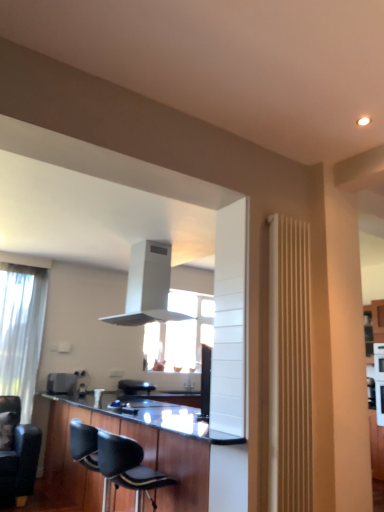
This screenshot has width=384, height=512. I want to click on white textured radiator at right, so click(289, 366).

What do you see at coordinates (115, 462) in the screenshot?
I see `black leather chair at lower center, arranged as the second chair when viewed from the left` at bounding box center [115, 462].

Identify the location of white sheer curtain at left. Image resolution: width=384 pixels, height=512 pixels. (21, 331).

Measure the distance between point (143, 254) and camera.

Point (143, 254) is 4.10 meters away from camera.

Locate an element on the screen. The width and height of the screenshot is (384, 512). white textured radiator at right is located at coordinates (289, 366).

Considering the points (177, 450) and (310, 458), which point is behind, point (177, 450) or point (310, 458)?

Positioned behind is point (177, 450).

From a real-world perspective, between black wood cabinetry at lower center and white textured radiator at right, who is vertically higher?

In real-world perspective, white textured radiator at right is above.

In the scene shown: Is black wood cabinetry at lower center taller than white textured radiator at right?

No, black wood cabinetry at lower center is not taller than white textured radiator at right.

Can we say black wood cabinetry at lower center lies outside white textured radiator at right?

black wood cabinetry at lower center is positioned outside white textured radiator at right.

Is black leather chair at lower center, which is counted as the second chair, starting from the back, beside black leather armchair at center?

No.

Measure the distance from black leather chair at lower center, which is counted as the first chair, starting from the right, to black leather armchair at center.

A distance of 1.19 meters exists between black leather chair at lower center, which is counted as the first chair, starting from the right, and black leather armchair at center.

From a real-world perspective, is black leather chair at lower center, which is counted as the first chair, starting from the right, positioned under black leather armchair at center based on gravity?

Yes, from a real-world perspective, black leather chair at lower center, which is counted as the first chair, starting from the right, is beneath black leather armchair at center.

Locate an element on the screen. The image size is (384, 512). the 1st chair directly beneath the black leather armchair at center (from a real-world perspective) is located at coordinates (115, 462).

How many degrees apart are the facing directions of black leather chair at lower left, which is counted as the 2th chair, starting from the front, and white matte exhaust hood at upper center?

black leather chair at lower left, which is counted as the 2th chair, starting from the front, and white matte exhaust hood at upper center are facing 91.3 degrees away from each other.

From the image's perspective, which object appears higher, black leather chair at lower left, the second chair in the right-to-left sequence, or white matte exhaust hood at upper center?

white matte exhaust hood at upper center appears higher in the image.

I want to click on exhaust hood above the black leather chair at lower left, the first chair positioned from the back (from the image's perspective), so 147,286.

Are black leather chair at lower left, which is counted as the 2th chair, starting from the front, and white matte exhaust hood at upper center far apart?

Yes.

Is black leather armchair at center positioned with its back to white sheer curtain at left?

No, white sheer curtain at left is not at the back of black leather armchair at center.

Looking at this image, is black leather armchair at center in contact with white sheer curtain at left?

There is a gap between black leather armchair at center and white sheer curtain at left.

From the image's perspective, would you say black leather armchair at center is shown under white sheer curtain at left?

Yes, from the image's perspective, black leather armchair at center is beneath white sheer curtain at left.

Is black leather armchair at center located outside white sheer curtain at left?

Yes.

How different are the orientations of white matte exhaust hood at upper center and satin black toaster at lower left in degrees?

The angular difference between white matte exhaust hood at upper center and satin black toaster at lower left is 2.75 degrees.

Looking at this image, is white matte exhaust hood at upper center far away from satin black toaster at lower left?

Yes, white matte exhaust hood at upper center and satin black toaster at lower left are located far from each other.

Looking at this image, which of these two, white matte exhaust hood at upper center or satin black toaster at lower left, is bigger?

With larger size is white matte exhaust hood at upper center.

From a real-world perspective, relative to satin black toaster at lower left, is white matte exhaust hood at upper center vertically above or below?

From a real-world perspective, white matte exhaust hood at upper center is physically above satin black toaster at lower left.

Is white matte exhaust hood at upper center turned away from black leather armchair at center?

No, white matte exhaust hood at upper center's orientation is not away from black leather armchair at center.

Is white matte exhaust hood at upper center outside of black leather armchair at center?

Indeed, white matte exhaust hood at upper center is completely outside black leather armchair at center.

How different are the orientations of white matte exhaust hood at upper center and black leather armchair at center in degrees?

92.6 degrees separate the facing orientations of white matte exhaust hood at upper center and black leather armchair at center.

Relative to black leather armchair at center, is white matte exhaust hood at upper center in front or behind?

Clearly, white matte exhaust hood at upper center is in front of black leather armchair at center.

Who is shorter, black wood cabinetry at lower center or white matte exhaust hood at upper center?

white matte exhaust hood at upper center is shorter.

From the image's perspective, who appears lower, black wood cabinetry at lower center or white matte exhaust hood at upper center?

black wood cabinetry at lower center is shown below in the image.

Find the location of `cabinetry to the right of white matte exhaust hood at upper center`. cabinetry to the right of white matte exhaust hood at upper center is located at coordinates (153, 454).

Considering the relative positions of black wood cabinetry at lower center and white matte exhaust hood at upper center in the image provided, is black wood cabinetry at lower center to the left of white matte exhaust hood at upper center from the viewer's perspective?

No.

You are a GUI agent. You are given a task and a screenshot of the screen. Output one action in this format:
    pyautogui.click(x=<x>, y=<y>)
    Task: Click on the cabinetry to the left of white textured radiator at right
    The image size is (384, 512).
    Given the screenshot: What is the action you would take?
    pyautogui.click(x=153, y=454)

In the image, there is a black leather armchair at center. Find the location of `chair above it (from the image's perspective)`. chair above it (from the image's perspective) is located at coordinates (115, 462).

Looking at the image, which one is located further to black leather chair at lower center, which is counted as the first chair, starting from the right, satin black toaster at lower left or black leather chair at lower left, the second chair in the right-to-left sequence?

The object further to black leather chair at lower center, which is counted as the first chair, starting from the right, is satin black toaster at lower left.

Based on their spatial positions, is black leather chair at lower left, which is counted as the 2th chair, starting from the front, or black wood cabinetry at lower center closer to white matte exhaust hood at upper center?

Based on the image, black wood cabinetry at lower center appears to be nearer to white matte exhaust hood at upper center.

Which object lies further to the anchor point white textured radiator at right, white sheer curtain at left or white matte exhaust hood at upper center?

The object further to white textured radiator at right is white sheer curtain at left.

Which object lies nearer to the anchor point white textured radiator at right, satin black toaster at lower left or white sheer curtain at left?

satin black toaster at lower left lies closer to white textured radiator at right than the other object.

Looking at the image, which one is located further to white sheer curtain at left, white textured radiator at right or satin black toaster at lower left?

white textured radiator at right.

Consider the image. Estimate the real-world distances between objects in this image. Which object is closer to satin black toaster at lower left, white textured radiator at right or black leather chair at lower center, which is counted as the first chair, starting from the right?

black leather chair at lower center, which is counted as the first chair, starting from the right, lies closer to satin black toaster at lower left than the other object.

From the image, which object appears to be nearer to white matte exhaust hood at upper center, white sheer curtain at left or black leather chair at lower center, which is counted as the second chair, starting from the back?

Among the two, black leather chair at lower center, which is counted as the second chair, starting from the back, is located nearer to white matte exhaust hood at upper center.

Which object lies nearer to the anchor point black leather armchair at center, white textured radiator at right or white sheer curtain at left?

Among the two, white sheer curtain at left is located nearer to black leather armchair at center.

Image resolution: width=384 pixels, height=512 pixels. Find the location of `appliance positioned between black leather chair at lower center, the 1th chair in the front-to-back sequence, and black leather armchair at center from near to far`. appliance positioned between black leather chair at lower center, the 1th chair in the front-to-back sequence, and black leather armchair at center from near to far is located at coordinates (61, 383).

Where is `exhaust hood between black leather chair at lower left, the second chair in the right-to-left sequence, and black leather chair at lower center, arranged as the second chair when viewed from the left, from left to right`? The height and width of the screenshot is (512, 384). exhaust hood between black leather chair at lower left, the second chair in the right-to-left sequence, and black leather chair at lower center, arranged as the second chair when viewed from the left, from left to right is located at coordinates (147, 286).

Where is `exhaust hood between black leather chair at lower center, which is counted as the second chair, starting from the back, and satin black toaster at lower left, along the z-axis`? This screenshot has width=384, height=512. exhaust hood between black leather chair at lower center, which is counted as the second chair, starting from the back, and satin black toaster at lower left, along the z-axis is located at coordinates (147, 286).

At what (x,y) coordinates should I click in order to perform the action: click on chair between black leather chair at lower center, the 1th chair in the front-to-back sequence, and white sheer curtain at left from front to back. Please return your answer as a coordinate pair (x, y). The width and height of the screenshot is (384, 512). Looking at the image, I should click on (18, 455).